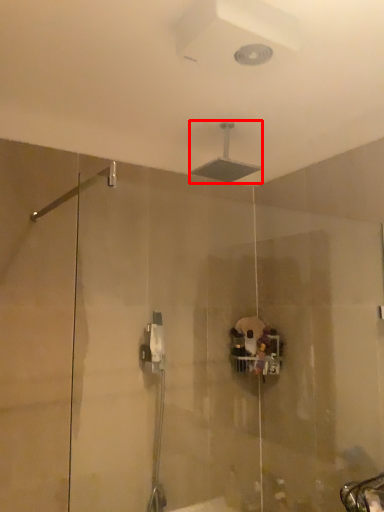
Question: From the image's perspective, where is shower (annotated by the red box) located relative to shower?

Choices:
 (A) below
 (B) above

Answer: (B)